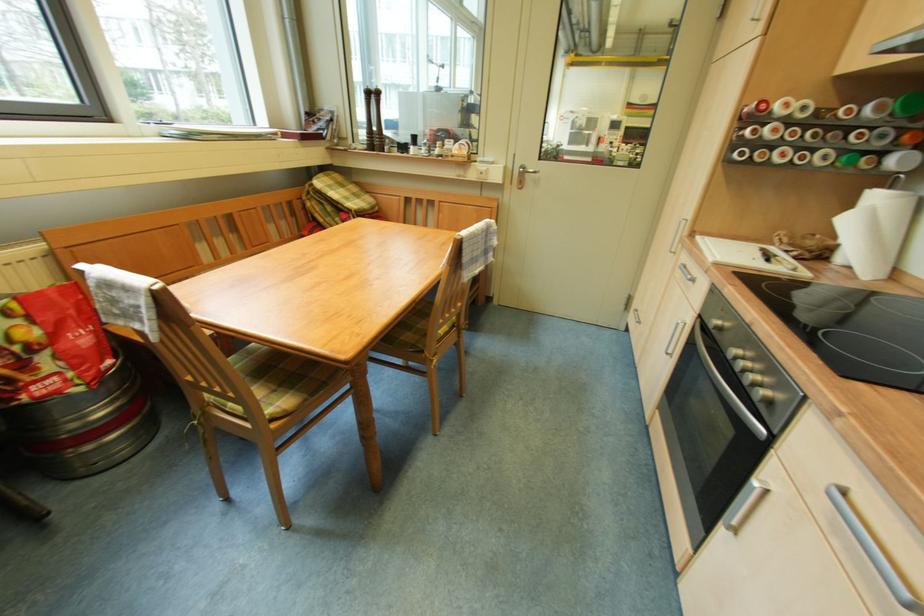
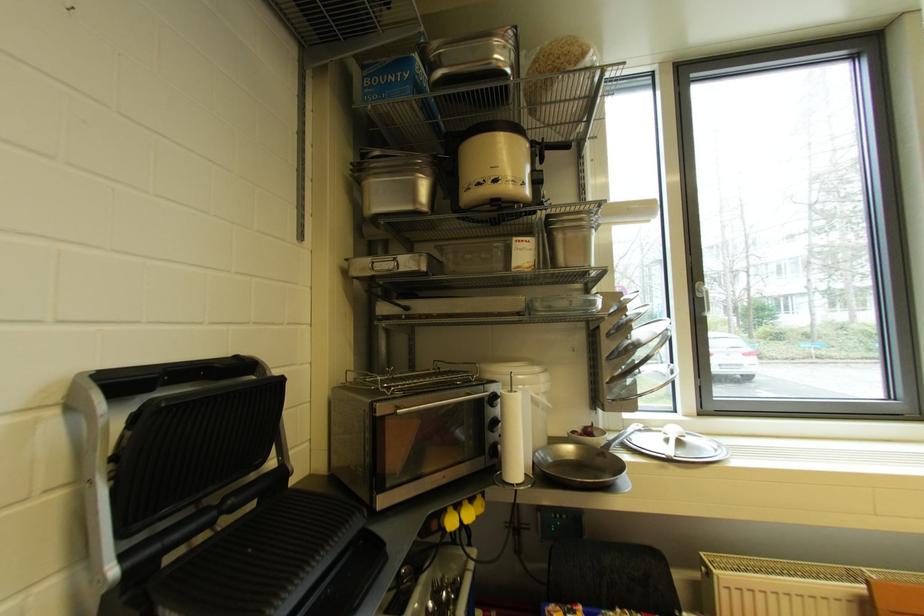
Question: The images are taken continuously from a first-person perspective. In which direction is your viewpoint rotating?

Choices:
 (A) Left
 (B) Right
 (C) Up
 (D) Down

Answer: (A)